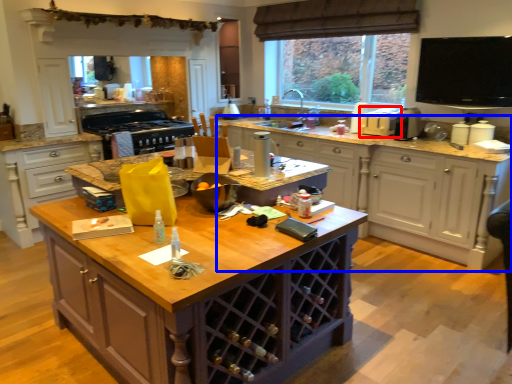
Question: Which point is further to the camera, appliance (highlighted by a red box) or cabinetry (highlighted by a blue box)?

Choices:
 (A) appliance
 (B) cabinetry

Answer: (A)